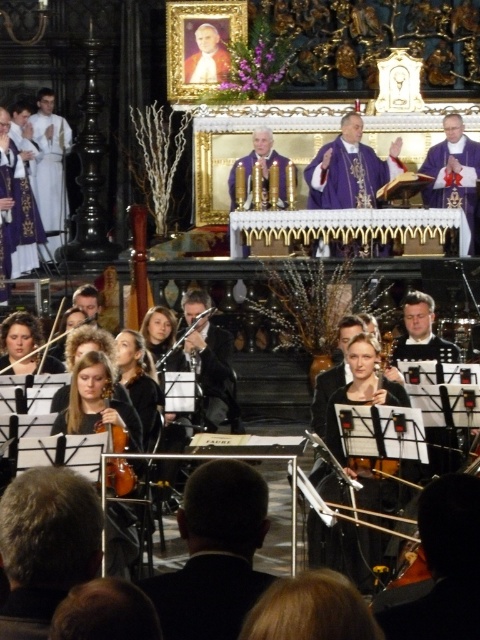
You are attending this religious ceremony and want to know which object is shorter between the black smooth suit at lower center and the purple velvet robe at left. Can you determine this based on their positions?

The black smooth suit at lower center is not as tall as the purple velvet robe at left, so the black smooth suit at lower center is shorter.

Consider the image. You are attending a formal religious ceremony and notice two key figures in the scene. One is wearing a black smooth suit at lower center, and the other is in a purple velvet robe at left. Based on their positions, which figure is closer to the front of the altar area?

The black smooth suit at lower center is closer to the front of the altar area because it is positioned in front of the purple velvet robe at left.

You are an attendee at this ceremony and want to know the position of the clergy members wearing purple robes. Specifically, where is the purple satin robe at upper center in relation to the purple velvet robe at upper right?

The purple satin robe at upper center is positioned to the left of the purple velvet robe at upper right.